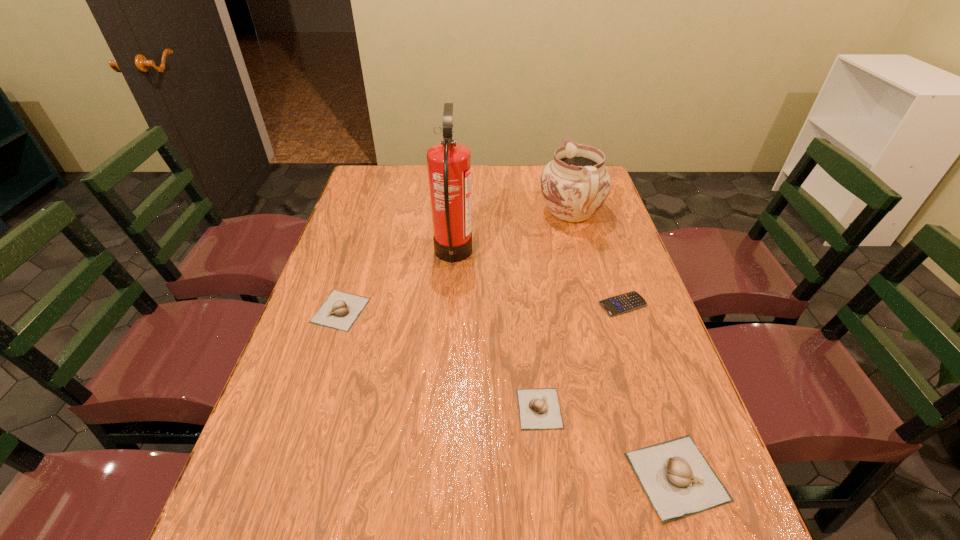
Where is `the leftmost object`? The height and width of the screenshot is (540, 960). the leftmost object is located at coordinates coord(340,310).

Identify the location of the farthest garlic. (340, 310).

You are a GUI agent. You are given a task and a screenshot of the screen. Output one action in this format:
    pyautogui.click(x=<x>, y=<y>)
    Task: Click on the second garlic from left to right
    The height and width of the screenshot is (540, 960).
    Given the screenshot: What is the action you would take?
    pyautogui.click(x=539, y=408)

At what (x,y) coordinates should I click in order to perform the action: click on the fourth object from right to left. Please return your answer as a coordinate pair (x, y). The height and width of the screenshot is (540, 960). Looking at the image, I should click on (539, 408).

Locate an element on the screen. The image size is (960, 540). the third tallest object is located at coordinates (678, 480).

Find the location of a particular element. The width and height of the screenshot is (960, 540). the tallest garlic is located at coordinates (678, 480).

Locate an element on the screen. This screenshot has width=960, height=540. the shortest object is located at coordinates (626, 302).

Where is `the tallest object`? the tallest object is located at coordinates (449, 163).

Locate an element on the screen. fire extinguisher is located at coordinates (449, 163).

This screenshot has width=960, height=540. In order to click on the second tallest object in this screenshot , I will do `click(575, 184)`.